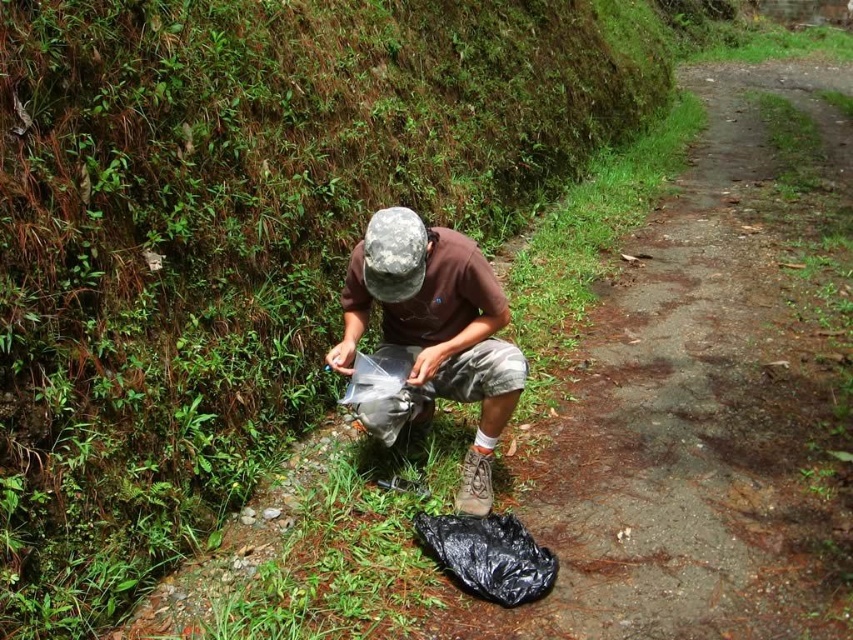
Which is below, matte gray cap at center or black plastic bag at lower center?

black plastic bag at lower center is below.

Between point (418, 228) and point (511, 516), which one is positioned in front?

Point (418, 228)

What do you see at coordinates (436, 328) in the screenshot? I see `matte gray cap at center` at bounding box center [436, 328].

Find the location of a particular element. matte gray cap at center is located at coordinates (436, 328).

Does black plastic bag at lower center appear under transparent plastic bag at center?

Yes.

Who is more distant from viewer, [519,528] or [369,358]?

Point [369,358]

Locate an element on the screen. The height and width of the screenshot is (640, 853). black plastic bag at lower center is located at coordinates (488, 556).

Locate an element on the screen. black plastic bag at lower center is located at coordinates (488, 556).

Who is higher up, matte gray cap at center or transparent plastic bag at center?

matte gray cap at center is above.

Is matte gray cap at center positioned before transparent plastic bag at center?

That is True.

I want to click on matte gray cap at center, so coord(436,328).

Where is `matte gray cap at center`? The image size is (853, 640). matte gray cap at center is located at coordinates click(436, 328).